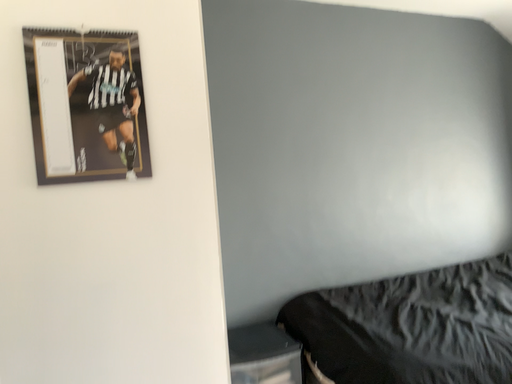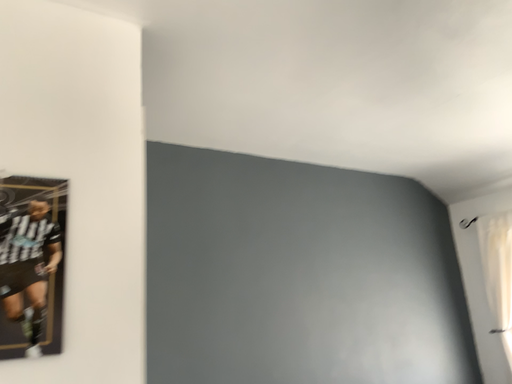
Question: Which way did the camera rotate in the video?

Choices:
 (A) rotated upward
 (B) rotated downward

Answer: (A)